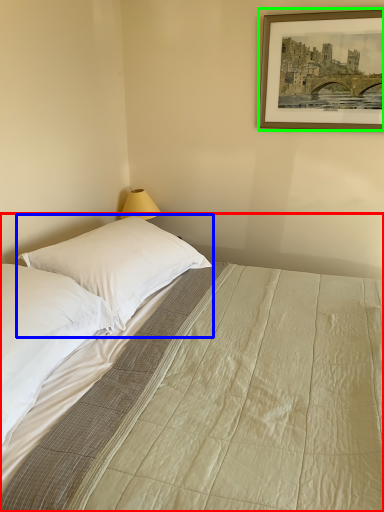
Question: Considering the real-world distances, which object is farthest from bed (highlighted by a red box)? pillow (highlighted by a blue box) or picture frame (highlighted by a green box)?

Choices:
 (A) pillow
 (B) picture frame

Answer: (B)